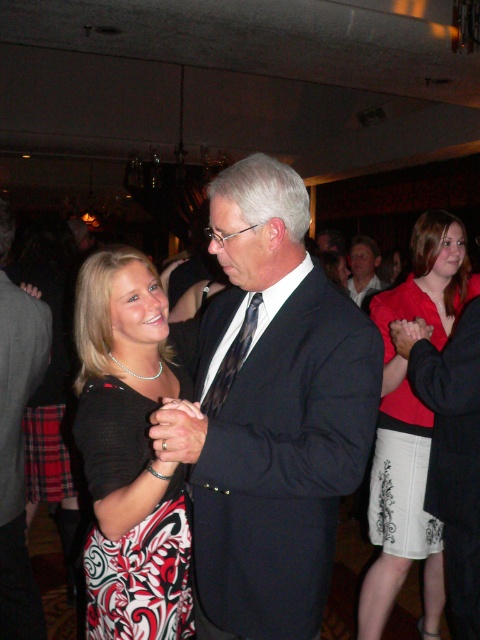
Is black satin dress at center taller than dark gray suit at center?

No, black satin dress at center is not taller than dark gray suit at center.

This screenshot has width=480, height=640. I want to click on black satin dress at center, so click(x=129, y=454).

Looking at this image, does matte red blouse at center appear on the left side of black silk tie at center?

In fact, matte red blouse at center is to the right of black silk tie at center.

Which is behind, point (423, 547) or point (219, 381)?

Point (423, 547)

The height and width of the screenshot is (640, 480). Find the location of `matte red blouse at center`. matte red blouse at center is located at coordinates (410, 426).

Based on the photo, how far apart are matte red blouse at center and dark gray suit at center?

matte red blouse at center is 3.88 feet from dark gray suit at center.

Is matte red blouse at center positioned at the back of dark gray suit at center?

Yes, matte red blouse at center is further from the viewer.

Find the location of `matte red blouse at center`. matte red blouse at center is located at coordinates (410, 426).